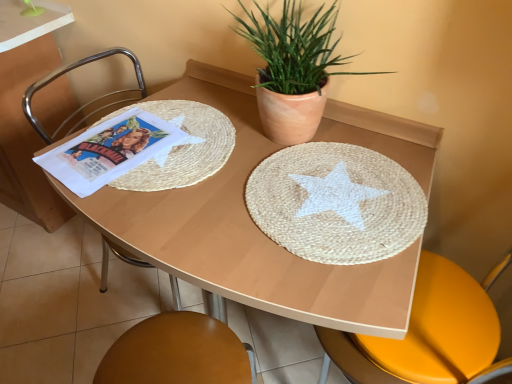
Where is `free space that is to the left of brushed metal chair at left`? free space that is to the left of brushed metal chair at left is located at coordinates (64, 291).